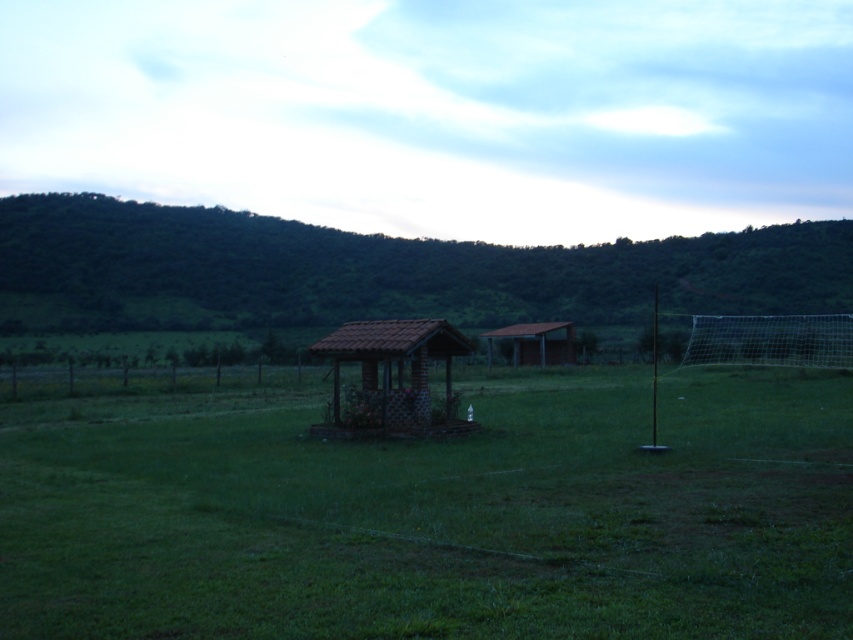
Question: Which point is farther to the camera?

Choices:
 (A) (567, 324)
 (B) (1, 304)
 (C) (202, 422)

Answer: (B)

Question: Is green grassy hillside at upper center to the left of brown corrugated metal hut at center from the viewer's perspective?

Choices:
 (A) yes
 (B) no

Answer: (A)

Question: Based on their relative distances, which object is nearer to the brown corrugated metal hut at center?

Choices:
 (A) brick/tiled hut at center
 (B) green grassy hillside at upper center
 (C) green grassy field at center

Answer: (B)

Question: Does green grassy hillside at upper center appear on the right side of brick/tiled hut at center?

Choices:
 (A) no
 (B) yes

Answer: (A)

Question: Is green grassy field at center to the left of green grassy hillside at upper center from the viewer's perspective?

Choices:
 (A) yes
 (B) no

Answer: (B)

Question: Which of the following is the closest to the observer?

Choices:
 (A) brown corrugated metal hut at center
 (B) brick/tiled hut at center
 (C) green grassy field at center

Answer: (C)